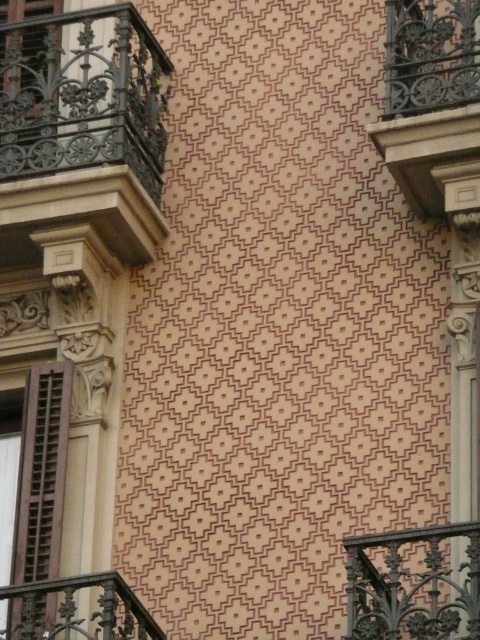
Is point (12, 188) more distant than point (23, 588)?

That is True.

Does dark brown wrought iron balcony at upper left have a greater height compared to dark brown wrought iron at lower left?

Incorrect, dark brown wrought iron balcony at upper left's height is not larger of dark brown wrought iron at lower left's.

Where is `dark brown wrought iron balcony at upper left`? This screenshot has width=480, height=640. dark brown wrought iron balcony at upper left is located at coordinates (82, 131).

Between dark brown wrought iron at lower right and dark brown wrought iron at lower left, which one is positioned higher?

Positioned higher is dark brown wrought iron at lower right.

Between dark brown wrought iron at lower right and dark brown wrought iron at lower left, which one has less height?

With less height is dark brown wrought iron at lower left.

I want to click on dark brown wrought iron at lower right, so click(x=410, y=586).

Is point (137, 42) farther from camera compared to point (429, 54)?

Yes.

Which is behind, point (79, 13) or point (466, 108)?

The point (79, 13) is more distant.

You are a GUI agent. You are given a task and a screenshot of the screen. Output one action in this format:
    pyautogui.click(x=<x>, y=<y>)
    Task: Click on the dark brown wrought iron balcony at upper left
    The height and width of the screenshot is (640, 480).
    Given the screenshot: What is the action you would take?
    pyautogui.click(x=82, y=131)